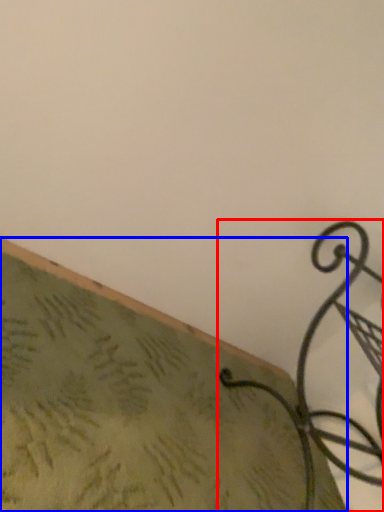
Question: Which object is further to the camera taking this photo, furniture (highlighted by a red box) or surface (highlighted by a blue box)?

Choices:
 (A) furniture
 (B) surface

Answer: (A)